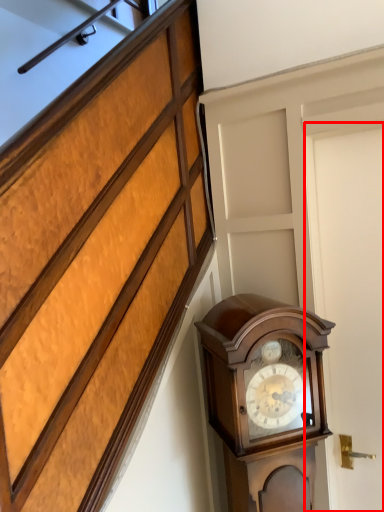
Question: Observing the image, what is the correct spatial positioning of door (annotated by the red box) in reference to wall clock?

Choices:
 (A) right
 (B) left

Answer: (A)